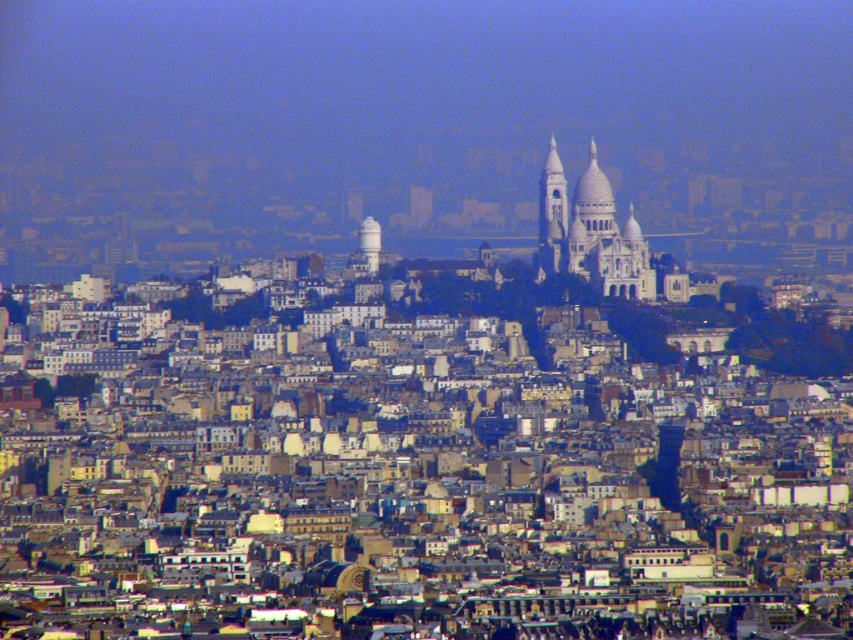
Question: Where is white stone church at center located in relation to smooth white tower at center in the image?

Choices:
 (A) below
 (B) above

Answer: (B)

Question: Which of the following is the closest to the observer?

Choices:
 (A) white stone church at center
 (B) smooth white tower at center

Answer: (B)

Question: Is the position of white stone church at center more distant than that of smooth white tower at center?

Choices:
 (A) yes
 (B) no

Answer: (A)

Question: Among these points, which one is nearest to the camera?

Choices:
 (A) (368, 230)
 (B) (584, 276)

Answer: (A)

Question: Is white stone church at center to the right of smooth white tower at center from the viewer's perspective?

Choices:
 (A) yes
 (B) no

Answer: (A)

Question: Among these objects, which one is farthest from the camera?

Choices:
 (A) smooth white tower at center
 (B) white stone church at center

Answer: (B)